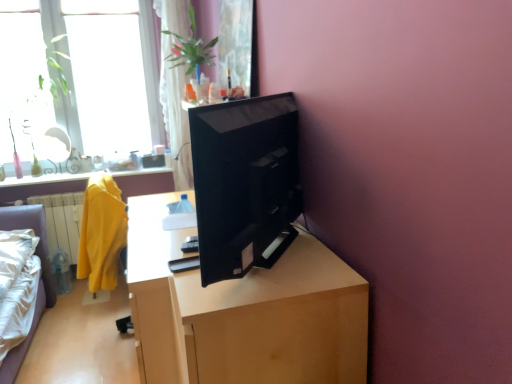
Question: Should I look upward or downward to see yellow fabric at left?

Choices:
 (A) down
 (B) up

Answer: (A)

Question: Should I look upward or downward to see matte yellow robe at left?

Choices:
 (A) up
 (B) down

Answer: (B)

Question: Is transparent glass window at upper left further to the viewer compared to matte yellow robe at left?

Choices:
 (A) no
 (B) yes

Answer: (B)

Question: Is transparent glass window at upper left facing away from matte yellow robe at left?

Choices:
 (A) no
 (B) yes

Answer: (A)

Question: Does transparent glass window at upper left have a greater width compared to matte yellow robe at left?

Choices:
 (A) no
 (B) yes

Answer: (A)

Question: Is transparent glass window at upper left at the right side of matte yellow robe at left?

Choices:
 (A) no
 (B) yes

Answer: (A)

Question: Can you confirm if transparent glass window at upper left is bigger than matte yellow robe at left?

Choices:
 (A) yes
 (B) no

Answer: (B)

Question: Is the depth of transparent glass window at upper left less than that of matte yellow robe at left?

Choices:
 (A) yes
 (B) no

Answer: (B)

Question: Could you tell me if yellow fabric at left is turned towards black glossy monitor at center?

Choices:
 (A) yes
 (B) no

Answer: (B)

Question: Can you confirm if yellow fabric at left is shorter than black glossy monitor at center?

Choices:
 (A) no
 (B) yes

Answer: (A)

Question: Can you confirm if yellow fabric at left is positioned to the left of black glossy monitor at center?

Choices:
 (A) no
 (B) yes

Answer: (B)

Question: Are yellow fabric at left and black glossy monitor at center making contact?

Choices:
 (A) yes
 (B) no

Answer: (B)

Question: From the image's perspective, would you say yellow fabric at left is shown under black glossy monitor at center?

Choices:
 (A) no
 (B) yes

Answer: (B)

Question: From the image's perspective, is yellow fabric at left over black glossy monitor at center?

Choices:
 (A) yes
 (B) no

Answer: (B)

Question: From a real-world perspective, is wooden desk at center below black glossy monitor at center?

Choices:
 (A) yes
 (B) no

Answer: (A)